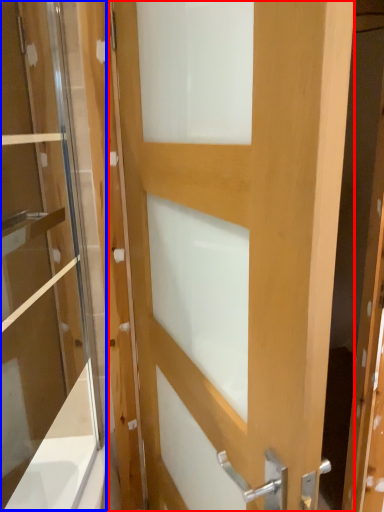
Question: Which object is closer to the camera taking this photo, door (highlighted by a red box) or screen door (highlighted by a blue box)?

Choices:
 (A) door
 (B) screen door

Answer: (A)